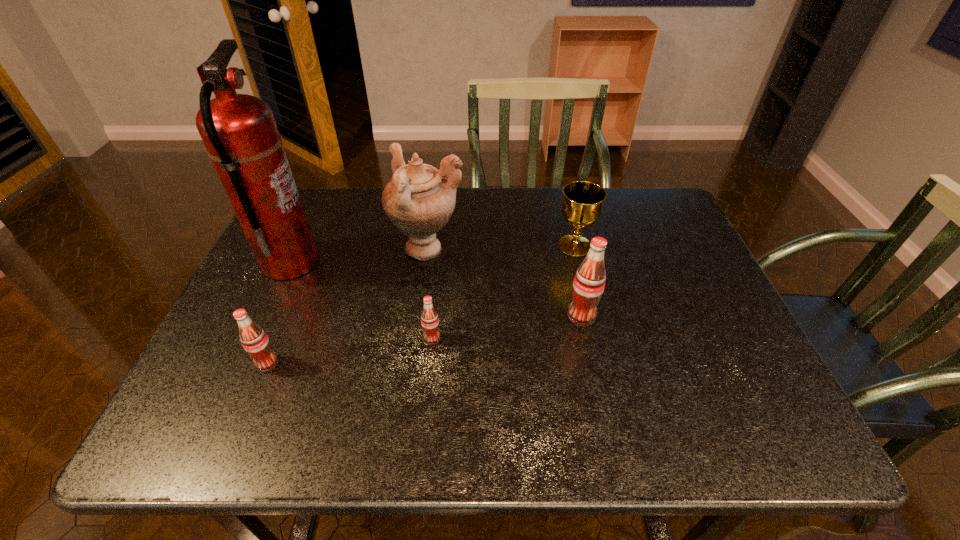
Please point a spot on the right to add another soda. Please provide its 2D coordinates. Your answer should be formatted as a tuple, i.e. [(x, y)], where the tuple contains the x and y coordinates of a point satisfying the conditions above.

[(718, 296)]